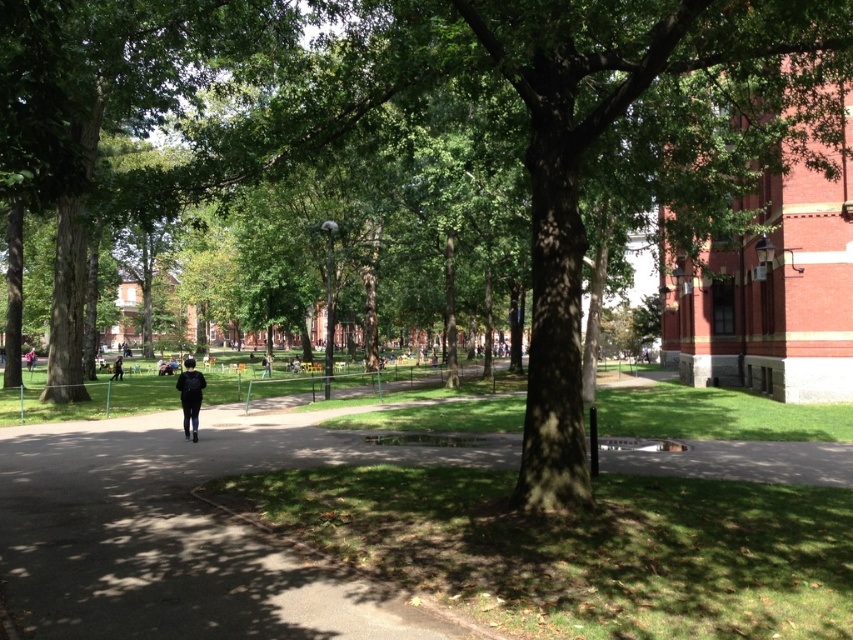
You are a photographer standing in the park and want to capture both the dark blue jeans at center and the black fabric backpack at center in a single frame. Since you want to ensure both items are fully visible, which object should you position closer to the camera to avoid cropping?

The dark blue jeans at center is wider than the black fabric backpack at center. To ensure both are fully visible, position the dark blue jeans at center closer to the camera since its greater width requires more space in the frame.

You are standing at the entrance of the park and see the black fabric backpack at center. If you walk straight ahead along the path, will you pass by the backpack before reaching the tree with the thick trunk?

The black fabric backpack at center is located at point (x=117, y=369), which is closer to the entrance than the tree with the thick trunk. Therefore, you will pass by the backpack before reaching the tree with the thick trunk.

You are a photographer setting up a tripod in the park. You need to place the tripod between the dark blue jeans at center and the black backpack at center so that it doesn not block either item. Given that the tripod requires 1.2 meters of space to avoid obstruction, is there enough space between them?

The dark blue jeans at center is wider than the black backpack at center. However, the description only provides information about their widths, not the distance between them. Without knowing the actual distance between the two objects, it is impossible to determine if the 1.2 meters of space required for the tripod is available.